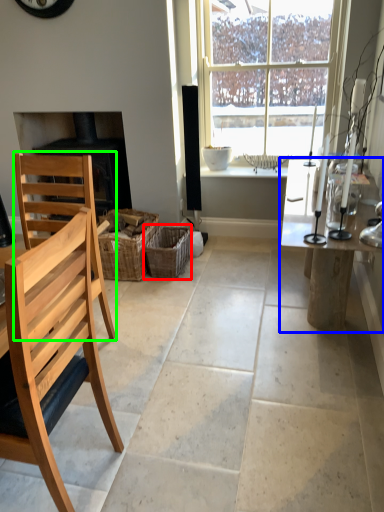
Question: Considering the real-world distances, which object is closest to crate (highlighted by a red box)? table (highlighted by a blue box) or chair (highlighted by a green box).

Choices:
 (A) table
 (B) chair

Answer: (B)